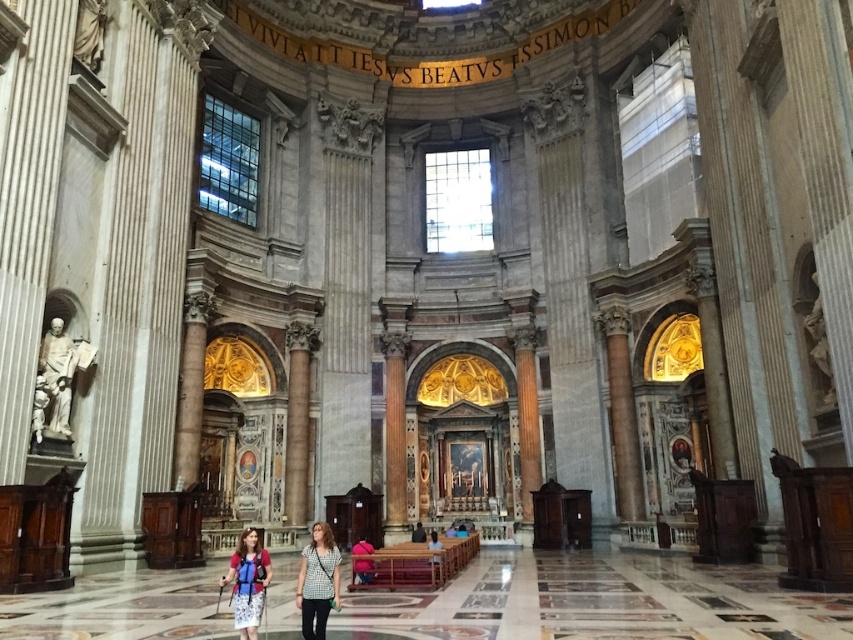
Based on the photo, you are a visitor in the cathedral and need to pass through the central aisle. You see a matte black backpack at center and a light brown leather jacket at center. Which item is wider and might block your path more?

The matte black backpack at center might be wider than the light brown leather jacket at center, so it could block your path more.

You are a visitor in this cathedral and see both the matte black backpack at center and the light brown leather jacket at center. Which object is closer to the floor?

The matte black backpack at center is shorter than the light brown leather jacket at center, so it is closer to the floor.

You are standing at the entrance of the cathedral and notice a person wearing a checkered fabric shirt at center. If you want to approach them, which direction should you move relative to the columns on your left and right?

Since the checkered fabric shirt at center is located at point 0.909 on the x and 0.373 on the y, you should move forward towards the center of the cathedral between the columns on your left and right to reach them.